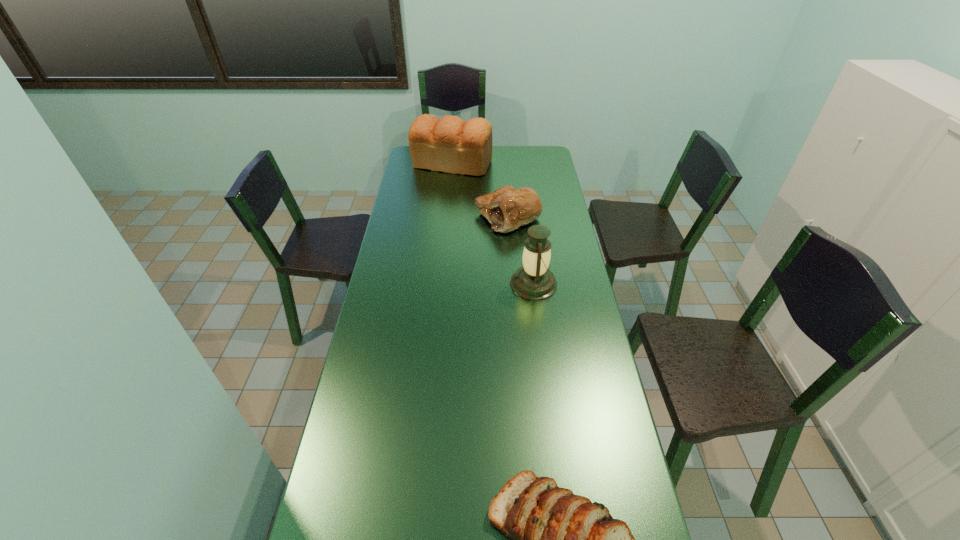
Find the location of `the farthest object`. the farthest object is located at coordinates (450, 144).

Locate an element on the screen. the tallest bread is located at coordinates (450, 144).

Locate an element on the screen. Image resolution: width=960 pixels, height=540 pixels. the second nearest object is located at coordinates (534, 281).

I want to click on the second nearest bread, so click(x=507, y=208).

Locate an element on the screen. Image resolution: width=960 pixels, height=540 pixels. the second shortest object is located at coordinates (507, 208).

This screenshot has width=960, height=540. What are the coordinates of `vacant space located 0.200m on the right of the farthest bread` in the screenshot? It's located at (531, 164).

I want to click on vacant region located with the light compartment facing forward on the lantern, so click(483, 284).

You are a GUI agent. You are given a task and a screenshot of the screen. Output one action in this format:
    pyautogui.click(x=<x>, y=<y>)
    Task: Click on the free spot located with the light compartment facing forward on the lantern
    The image size is (960, 540).
    Given the screenshot: What is the action you would take?
    pyautogui.click(x=412, y=284)

Locate an element on the screen. This screenshot has width=960, height=540. vacant space located with the light compartment facing forward on the lantern is located at coordinates (412, 284).

Image resolution: width=960 pixels, height=540 pixels. Find the location of `free space located on the filling side of the second farthest object`. free space located on the filling side of the second farthest object is located at coordinates (411, 217).